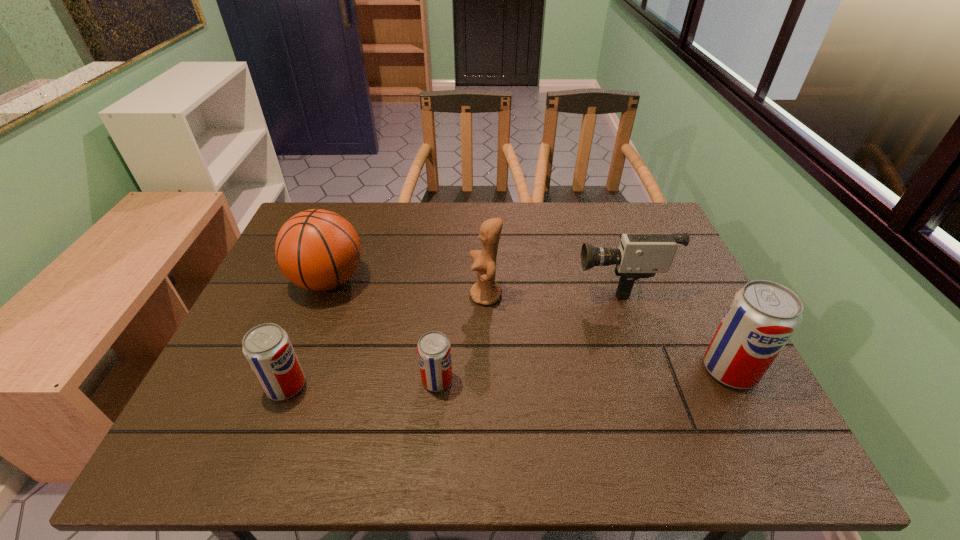
Identify the location of free space between the rightmost soda and the basketball. (529, 325).

I want to click on free space between the shortest soda and the tallest soda, so click(584, 375).

At what (x,y) coordinates should I click in order to perform the action: click on free space between the tallest soda and the second shortest soda. Please return your answer as a coordinate pair (x, y). Image resolution: width=960 pixels, height=540 pixels. Looking at the image, I should click on (508, 377).

Locate an element on the screen. The image size is (960, 540). vacant point located between the leftmost soda and the fifth object from left to right is located at coordinates (451, 333).

The height and width of the screenshot is (540, 960). What are the coordinates of `unoccupied area between the second soda from right to left and the figurine` in the screenshot? It's located at (462, 338).

The width and height of the screenshot is (960, 540). What are the coordinates of `vacant space that is in between the rightmost soda and the basketball` in the screenshot? It's located at [x=529, y=325].

You are a GUI agent. You are given a task and a screenshot of the screen. Output one action in this format:
    pyautogui.click(x=<x>, y=<y>)
    Task: Click on the empty space that is in between the basketball and the leftmost soda
    The height and width of the screenshot is (540, 960).
    Given the screenshot: What is the action you would take?
    307,333

Locate an element on the screen. free space between the second soda from left to right and the basketball is located at coordinates (383, 330).

Identify the location of vacant area that lies between the leftmost soda and the third object from left to right. (362, 383).

Locate which object is the second closest to the basketball. Please provide its 2D coordinates. Your answer should be formatted as a tuple, i.e. [(x, y)], where the tuple contains the x and y coordinates of a point satisfying the conditions above.

[(434, 351)]